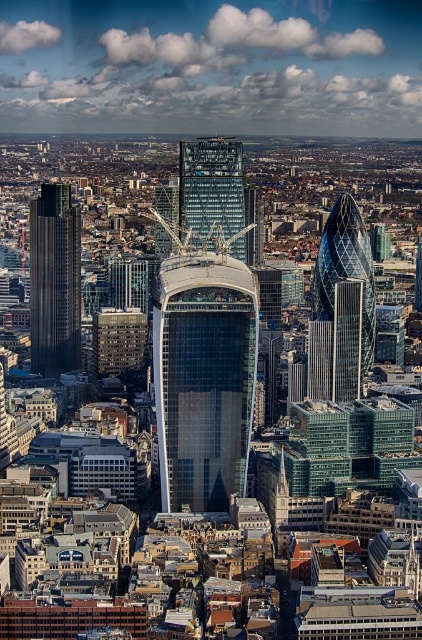
Question: Does transparent glass skyscraper at center have a lesser width compared to glassy reflective skyscraper at center?

Choices:
 (A) yes
 (B) no

Answer: (B)

Question: Which object is the farthest from the glassy skyscraper at center?

Choices:
 (A) glassy steel tower at center-right
 (B) dark gray glass skyscraper at left
 (C) glassy reflective skyscraper at center
 (D) transparent glass skyscraper at center

Answer: (A)

Question: Which object is closer to the camera taking this photo?

Choices:
 (A) glassy skyscraper at center
 (B) glassy reflective skyscraper at center

Answer: (B)

Question: Which point is closer to the camera?

Choices:
 (A) (208, 420)
 (B) (313, 369)

Answer: (A)

Question: Can you confirm if dark gray glass skyscraper at left is positioned to the left of glassy reflective skyscraper at center?

Choices:
 (A) yes
 (B) no

Answer: (A)

Question: Where is glassy reflective skyscraper at center located in relation to glassy skyscraper at center in the image?

Choices:
 (A) left
 (B) right

Answer: (B)